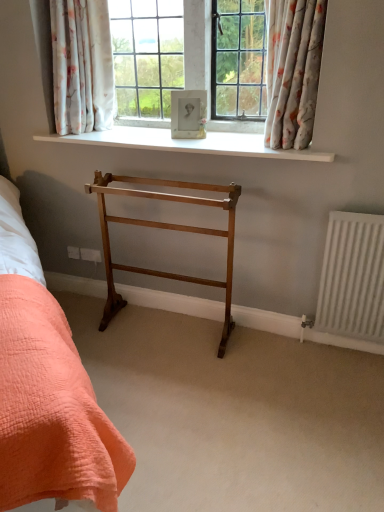
Question: Is floral fabric curtain at upper center, marked as the 1th curtain in a left-to-right arrangement, to the left or to the right of white smooth window sill at upper center in the image?

Choices:
 (A) left
 (B) right

Answer: (A)

Question: Is floral fabric curtain at upper center, marked as the 1th curtain in a left-to-right arrangement, spatially inside white smooth window sill at upper center, or outside of it?

Choices:
 (A) inside
 (B) outside

Answer: (B)

Question: Which of these objects is positioned closest to the light brown wood towel rack at center?

Choices:
 (A) porcelain frame at center
 (B) white matte radiator at right
 (C) floral fabric curtain at upper right, positioned as the 2th curtain in left-to-right order
 (D) floral fabric curtain at upper center, marked as the 1th curtain in a left-to-right arrangement
 (E) white smooth window sill at upper center

Answer: (E)

Question: Considering the real-world distances, which object is farthest from the white matte radiator at right?

Choices:
 (A) porcelain frame at center
 (B) floral fabric curtain at upper right, which is the 1th curtain from right to left
 (C) floral fabric curtain at upper center, positioned as the 2th curtain in right-to-left order
 (D) light brown wood towel rack at center
 (E) white smooth window sill at upper center

Answer: (C)